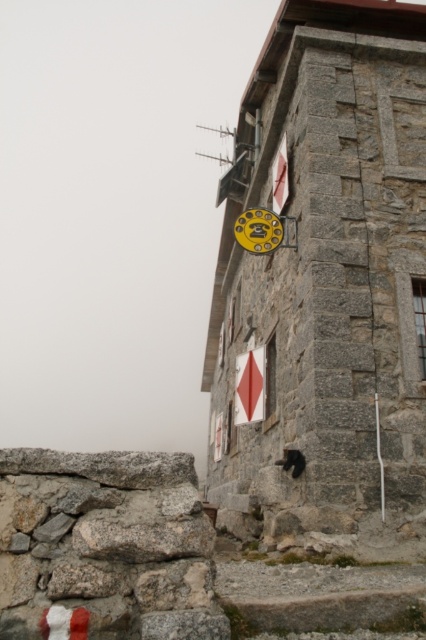
You are a hiker who just arrived at the stone building. You need to place your backpack on a surface. Which object from the stone textured tower at center and the gray rough stone at lower left would be more suitable for placing your backpack?

The gray rough stone at lower left is more suitable for placing your backpack because the stone textured tower at center is above it and likely elevated or not a flat surface.

You are an architect assessing the structural integrity of the stone textured tower at center and the gray rough stone at lower left. Which of these two objects has a greater width?

The stone textured tower at center has a greater width than the gray rough stone at lower left.